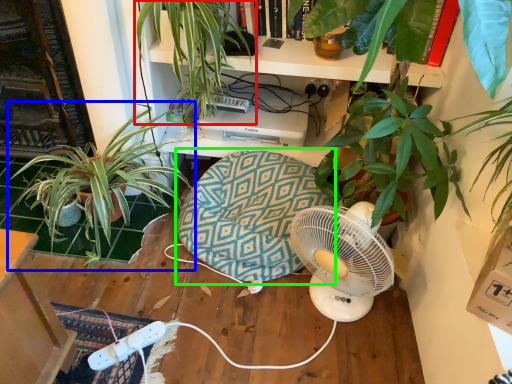
Question: Which is nearer to the houseplant (highlighted by a red box)? houseplant (highlighted by a blue box) or swivel chair (highlighted by a green box).

Choices:
 (A) houseplant
 (B) swivel chair

Answer: (A)